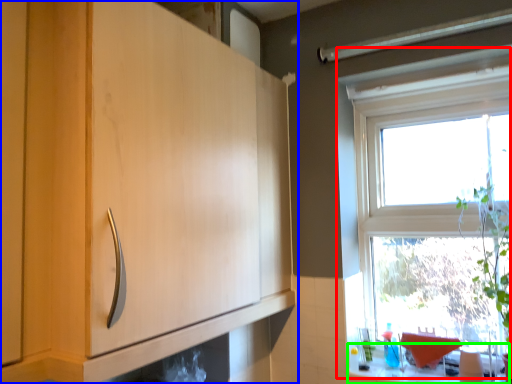
Question: Based on their relative distances, which object is farther from window (highlighted by a red box)? Choose from cabinetry (highlighted by a blue box) and counter top (highlighted by a green box).

Choices:
 (A) cabinetry
 (B) counter top

Answer: (A)